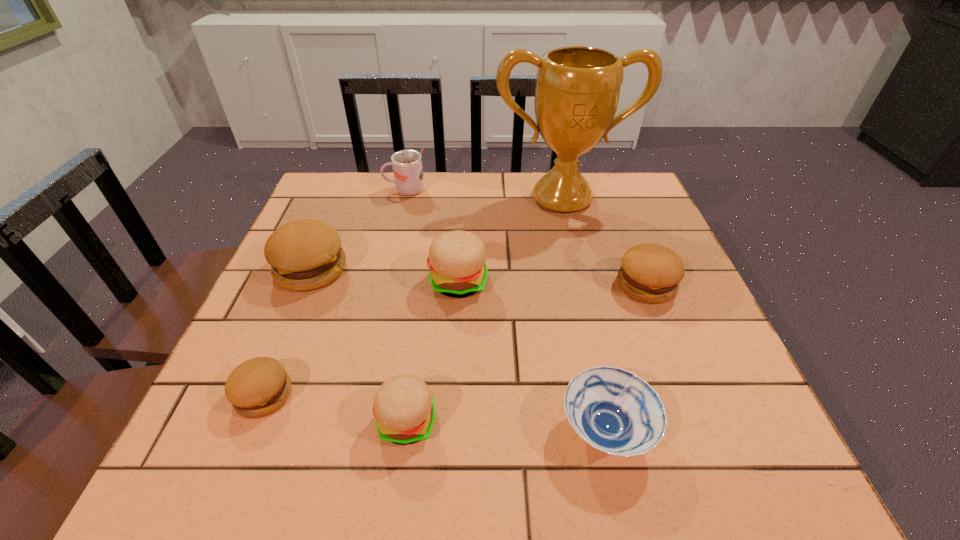
The height and width of the screenshot is (540, 960). What are the coordinates of `vacant area between the biggest brown hamburger and the cup` in the screenshot? It's located at 358,230.

Find the location of `object that is the closest to the second smallest brown hamburger`. object that is the closest to the second smallest brown hamburger is located at coordinates (577, 91).

At what (x,y) coordinates should I click in order to perform the action: click on the fifth closest object to the award. Please return your answer as a coordinate pair (x, y). Looking at the image, I should click on (615, 411).

Point out which hamburger is positioned as the fourth nearest to the rightmost hamburger. Please provide its 2D coordinates. Your answer should be formatted as a tuple, i.e. [(x, y)], where the tuple contains the x and y coordinates of a point satisfying the conditions above.

[(258, 387)]

Identify which hamburger is the third nearest to the cup. Please provide its 2D coordinates. Your answer should be formatted as a tuple, i.e. [(x, y)], where the tuple contains the x and y coordinates of a point satisfying the conditions above.

[(650, 273)]

Point out which brown hamburger is positioned as the nearest to the cup. Please provide its 2D coordinates. Your answer should be formatted as a tuple, i.e. [(x, y)], where the tuple contains the x and y coordinates of a point satisfying the conditions above.

[(306, 254)]

The image size is (960, 540). What are the coordinates of `the closest brown hamburger to the biggest brown hamburger` in the screenshot? It's located at (258, 387).

Identify the location of vacant position in the image that satisfies the following two spatial constraints: 1. on the front side of the soup bowl; 2. on the left side of the farther beige hamburger. The image size is (960, 540). (451, 430).